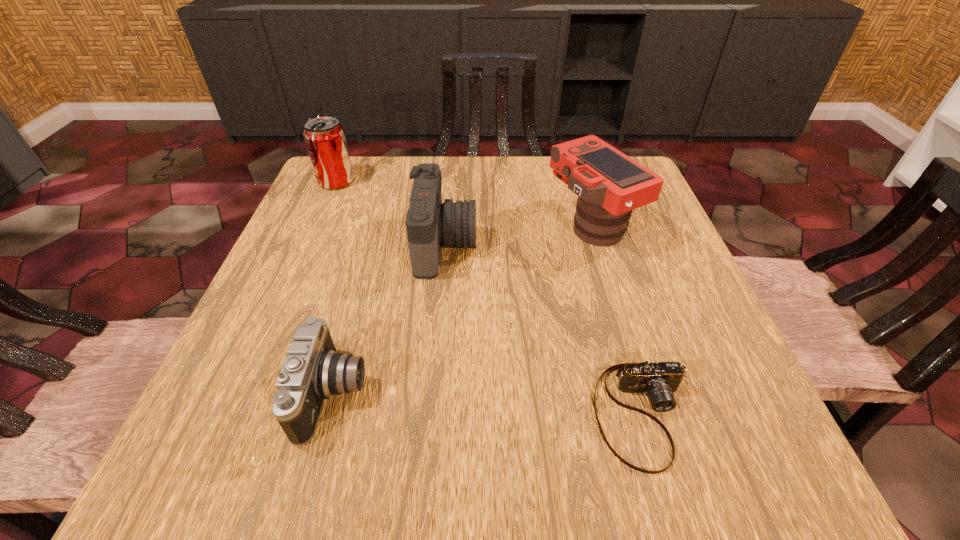
Where is `blank space at the right edge of the desktop`? This screenshot has width=960, height=540. blank space at the right edge of the desktop is located at coordinates (649, 210).

Where is `free space at the far left corner of the desktop`? free space at the far left corner of the desktop is located at coordinates (367, 200).

Where is `vacant space at the near left corner of the desktop`? vacant space at the near left corner of the desktop is located at coordinates (202, 433).

At what (x,y) coordinates should I click in order to perform the action: click on free space between the leftmost camera and the second camera from left to right. Please return your answer as a coordinate pair (x, y). This screenshot has width=960, height=540. Looking at the image, I should click on (390, 319).

In order to click on vacant space in between the shortest camera and the leftmost object in this screenshot , I will do `click(490, 298)`.

Where is `vacant area between the leftmost camera and the shortest object`? vacant area between the leftmost camera and the shortest object is located at coordinates (489, 404).

Find the location of a particular element. The width and height of the screenshot is (960, 540). blank region between the shortest camera and the third object from left to right is located at coordinates (543, 329).

This screenshot has width=960, height=540. Identify the location of empty location between the shortest camera and the fourth object from right to left. (489, 404).

The width and height of the screenshot is (960, 540). What are the coordinates of `blank region between the second shortest object and the farthest object` in the screenshot? It's located at (335, 287).

The width and height of the screenshot is (960, 540). I want to click on the closest object to the leftmost object, so click(x=429, y=223).